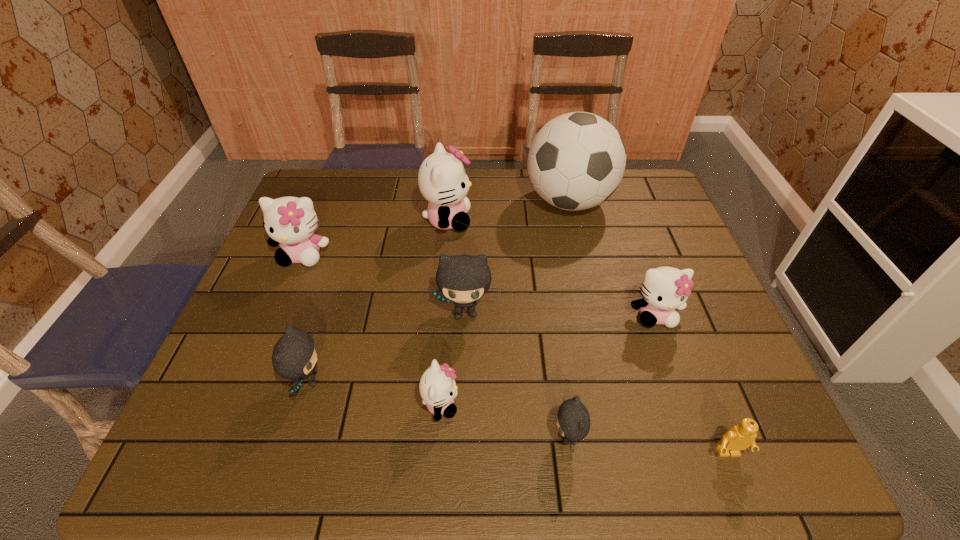
Find the location of a particular element. The image size is (960, 540). white kitten that stands as the closest to the tallest object is located at coordinates (442, 179).

The height and width of the screenshot is (540, 960). I want to click on gray kitten that stands as the second closest to the second biggest gray kitten, so click(573, 422).

Where is `gray kitten that is the third closest to the Lego`? gray kitten that is the third closest to the Lego is located at coordinates (294, 356).

This screenshot has width=960, height=540. What are the coordinates of `vacant position in the image that satisfies the following two spatial constraints: 1. on the front-facing side of the rightmost kitten; 2. on the front-facing side of the leftmost gray kitten` in the screenshot? It's located at (677, 380).

What are the coordinates of `free space that satisfies the following two spatial constraints: 1. on the front-facing side of the second gray kitten from left to right; 2. on the front-facing side of the leftmost gray kitten` in the screenshot? It's located at (463, 380).

Locate an element on the screen. vacant space that satisfies the following two spatial constraints: 1. on the front-facing side of the farthest gray kitten; 2. on the front-facing side of the smallest white kitten is located at coordinates (463, 404).

What are the coordinates of `free space that satisfies the following two spatial constraints: 1. on the front-facing side of the second nearest white kitten; 2. on the front-facing side of the leftmost gray kitten` in the screenshot? It's located at (677, 380).